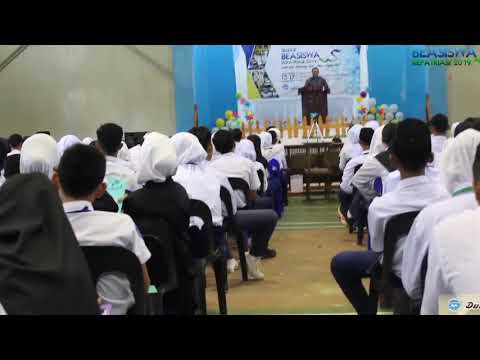
Find the location of `floor`. floor is located at coordinates (317, 261).